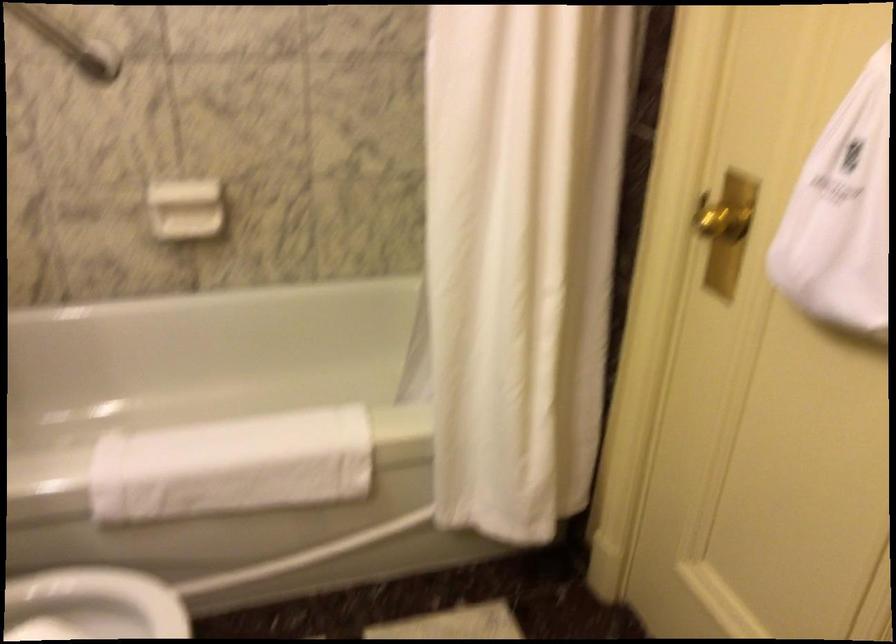
The location [841,214] corresponds to which object?

It corresponds to the white hanging bag in the image.